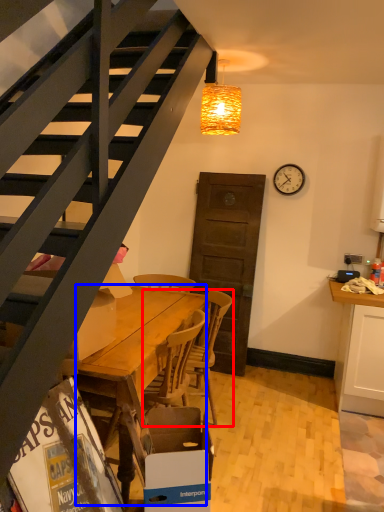
Question: Among these objects, which one is farthest to the camera, chair (highlighted by a red box) or desk (highlighted by a blue box)?

Choices:
 (A) chair
 (B) desk

Answer: (A)